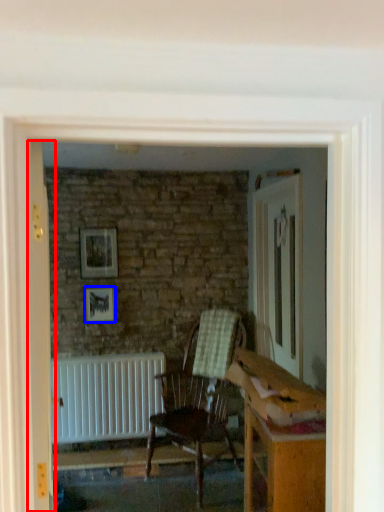
Question: Which object is closer to the camera taking this photo, door (highlighted by a red box) or picture frame (highlighted by a blue box)?

Choices:
 (A) door
 (B) picture frame

Answer: (A)